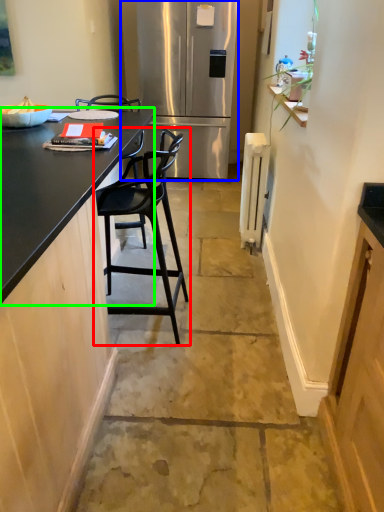
Question: Which object is the farthest from chair (highlighted by a red box)? Choose among these: refrigerator (highlighted by a blue box) or countertop (highlighted by a green box).

Choices:
 (A) refrigerator
 (B) countertop

Answer: (A)